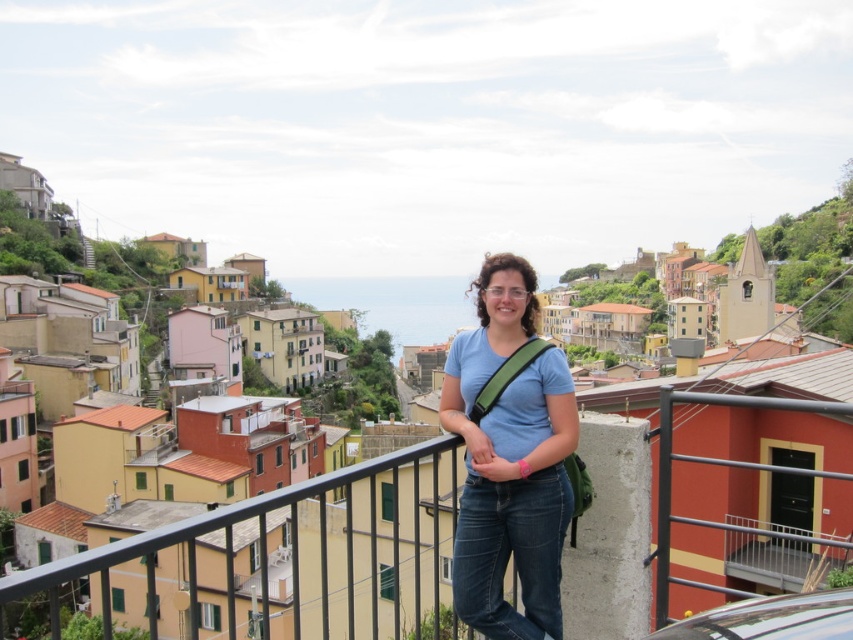
Can you confirm if matte blue shirt at center is thinner than metallic gray railing at lower right?

Correct, matte blue shirt at center's width is less than metallic gray railing at lower right's.

Is matte blue shirt at center bigger than metallic gray railing at lower right?

Actually, matte blue shirt at center might be smaller than metallic gray railing at lower right.

I want to click on matte blue shirt at center, so click(509, 460).